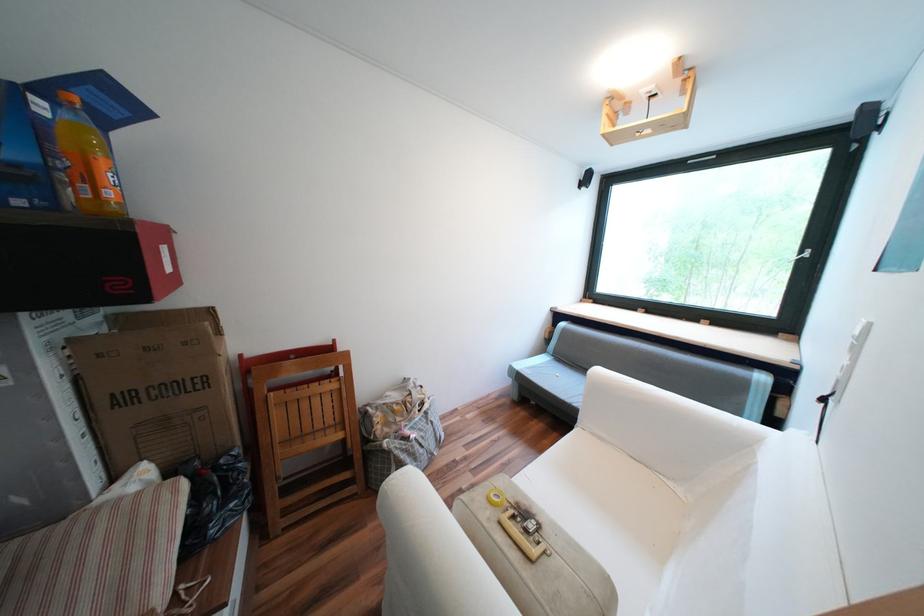
Locate an element on the screen. white window handle is located at coordinates (801, 254).